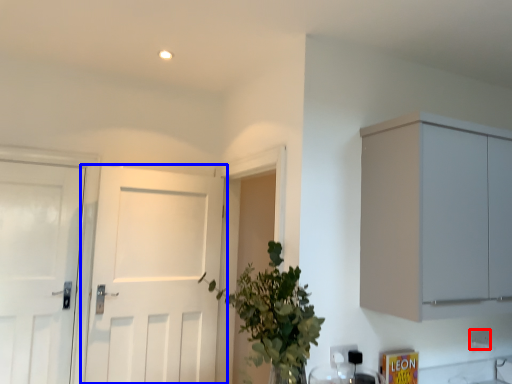
Question: Which object is further to the camera taking this photo, electric outlet (highlighted by a red box) or door (highlighted by a blue box)?

Choices:
 (A) electric outlet
 (B) door

Answer: (A)